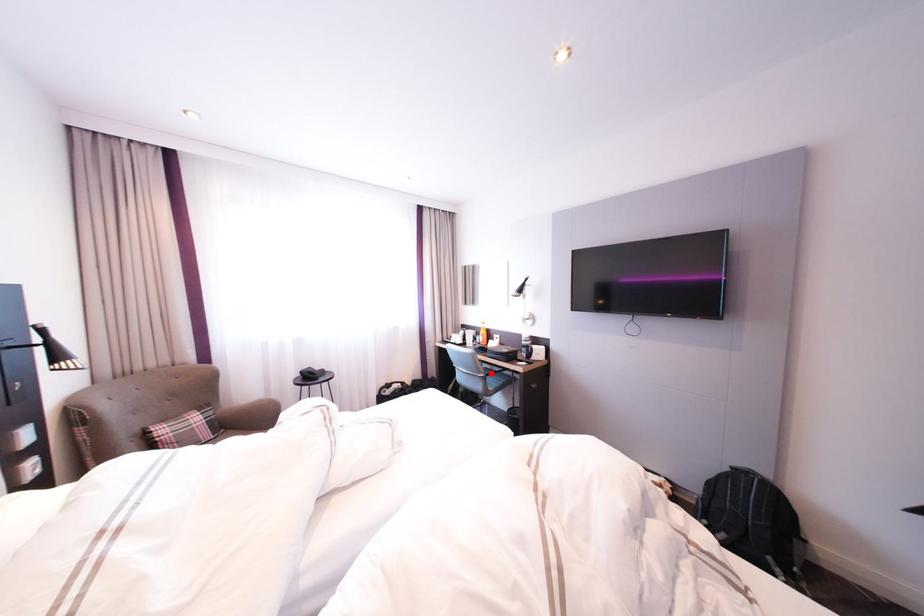
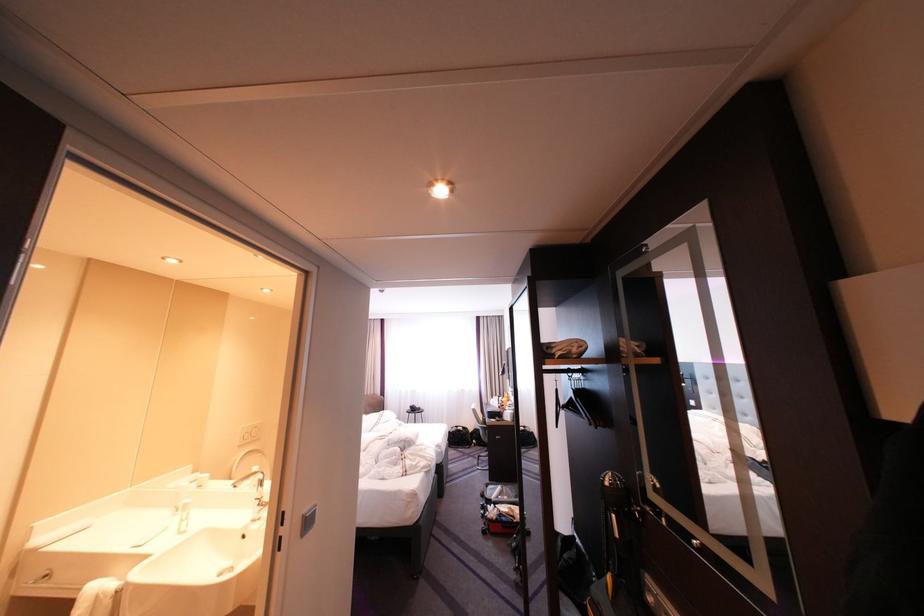
Find the pixel in the second image that matches the highlighted location in the first image.

(491, 424)